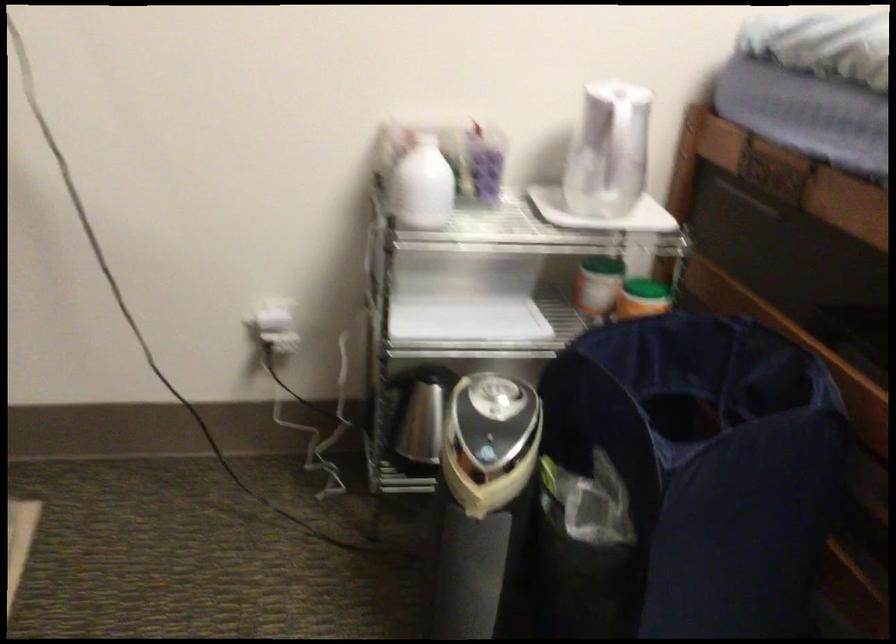
The image size is (896, 644). Find the location of `white pump bottle`. white pump bottle is located at coordinates point(421,185).